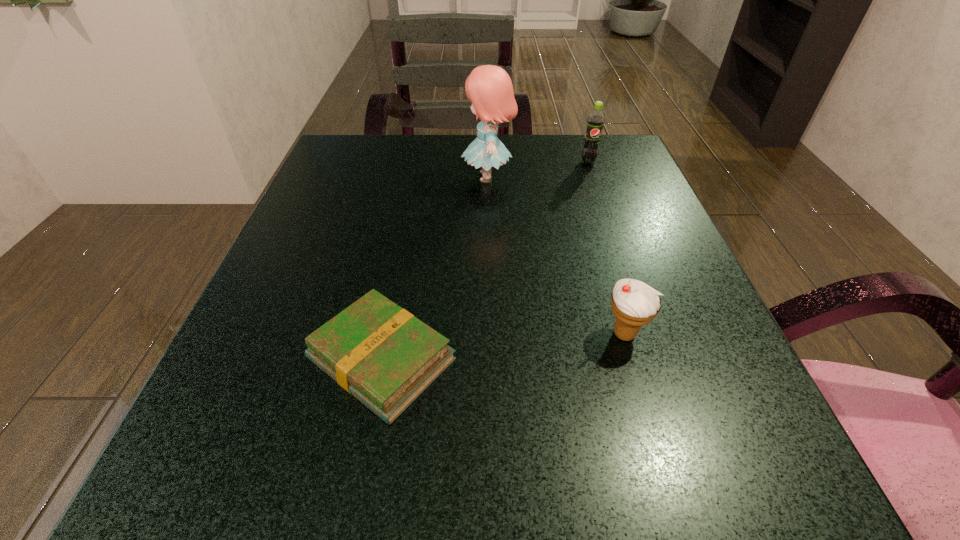
Locate an element on the screen. The image size is (960, 540). doll is located at coordinates (489, 88).

This screenshot has height=540, width=960. I want to click on soda, so click(x=595, y=121).

Locate an element on the screen. the second shortest object is located at coordinates (634, 303).

Locate an element on the screen. This screenshot has width=960, height=540. book is located at coordinates (383, 355).

Find the location of `vacant area situated on the front-facing side of the tallest object`. vacant area situated on the front-facing side of the tallest object is located at coordinates (430, 177).

Where is `free point located on the front-facing side of the tallest object`? The image size is (960, 540). free point located on the front-facing side of the tallest object is located at coordinates (398, 177).

Where is `vacant space situated 0.290m on the front-facing side of the tallest object`? vacant space situated 0.290m on the front-facing side of the tallest object is located at coordinates (330, 177).

Identify the location of vacant space located on the front label of the third shortest object. (600, 197).

Locate an element on the screen. vacant region located 0.050m on the left of the second shortest object is located at coordinates (568, 334).

You are a GUI agent. You are given a task and a screenshot of the screen. Output one action in this format:
    pyautogui.click(x=<x>, y=<y>)
    Task: Click on the vacant space situated 0.230m on the back of the shortest object
    
    Given the screenshot: What is the action you would take?
    pyautogui.click(x=409, y=219)